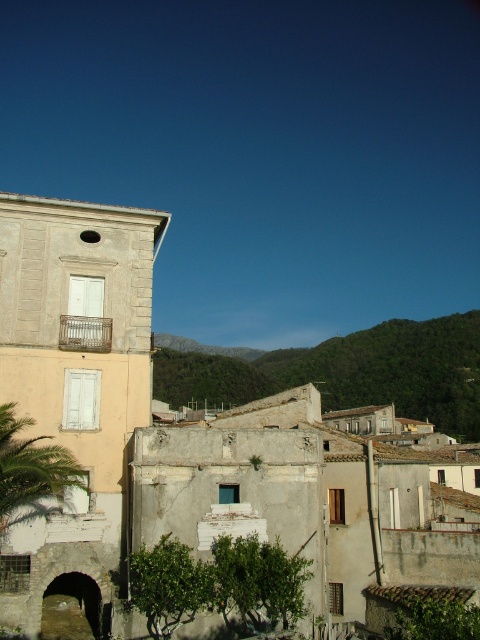
Who is higher up, light beige stone building at left or green leafy palm tree at lower left?

green leafy palm tree at lower left is higher up.

At what (x,y) coordinates should I click in order to perform the action: click on light beige stone building at left. Please return your answer as a coordinate pair (x, y). Looking at the image, I should click on (193, 442).

Who is more distant from viewer, [7,547] or [48,484]?

Point [7,547]

The width and height of the screenshot is (480, 640). What are the coordinates of `light beige stone building at left` in the screenshot? It's located at (193, 442).

Who is more distant from viewer, (x=432, y=374) or (x=66, y=456)?

Positioned behind is point (x=432, y=374).

Can you confirm if green leafy hillside at center is smaller than green leafy palm tree at lower left?

No.

Which is behind, point (470, 401) or point (33, 484)?

The point (470, 401) is behind.

You are a GUI agent. You are given a task and a screenshot of the screen. Output one action in this format:
    pyautogui.click(x=<x>, y=<y>)
    Task: Click on the green leafy hillside at center
    
    Given the screenshot: What is the action you would take?
    pyautogui.click(x=349, y=371)

Between light beige stone building at left and green leafy hillside at center, which one appears on the right side from the viewer's perspective?

green leafy hillside at center

Between light beige stone building at left and green leafy hillside at center, which one is positioned lower?

green leafy hillside at center is below.

Is point (66, 209) positioned in front of point (345, 344)?

That is True.

Find the location of a particular element. The height and width of the screenshot is (640, 480). light beige stone building at left is located at coordinates (193, 442).